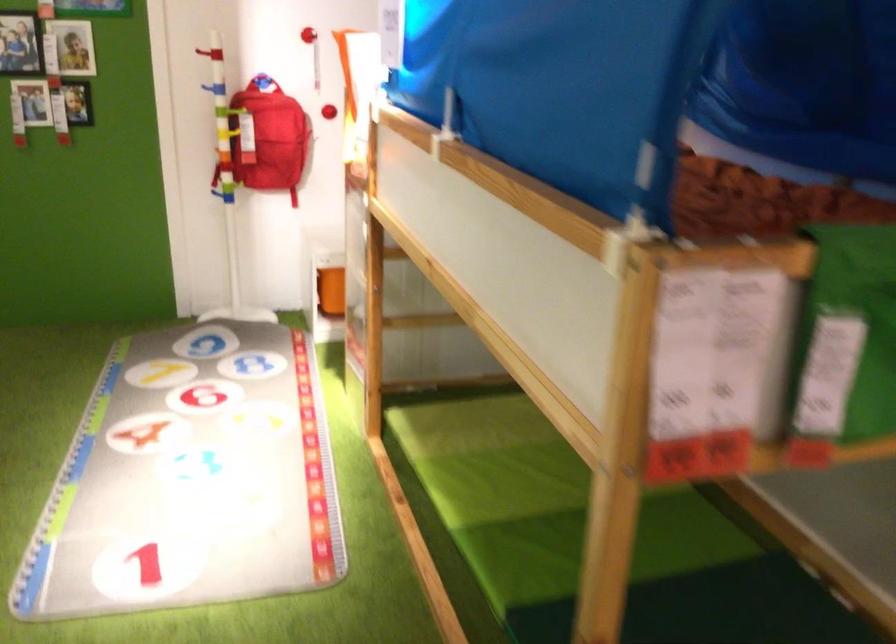
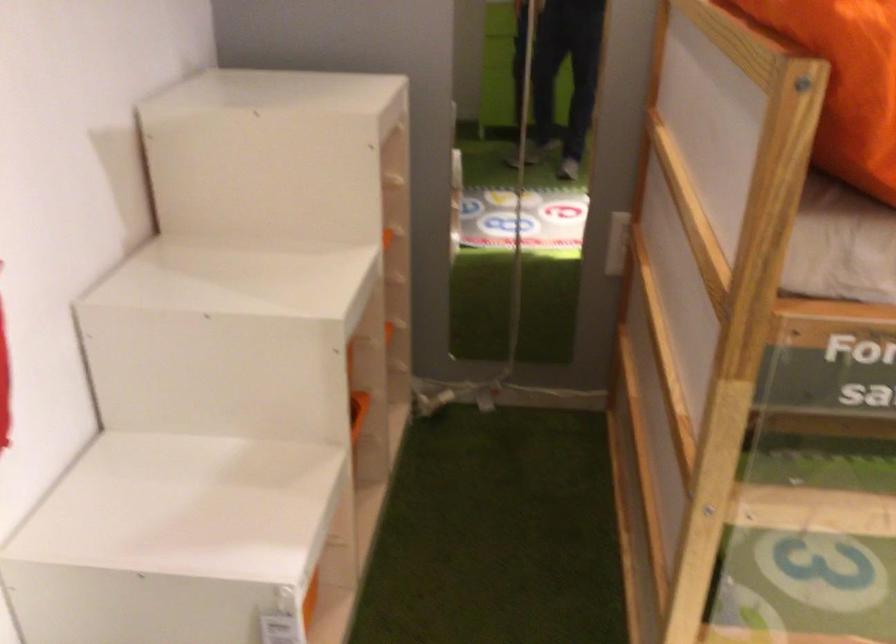
Where in the second image is the point corresponding to point 435,319 from the first image?

(642, 469)